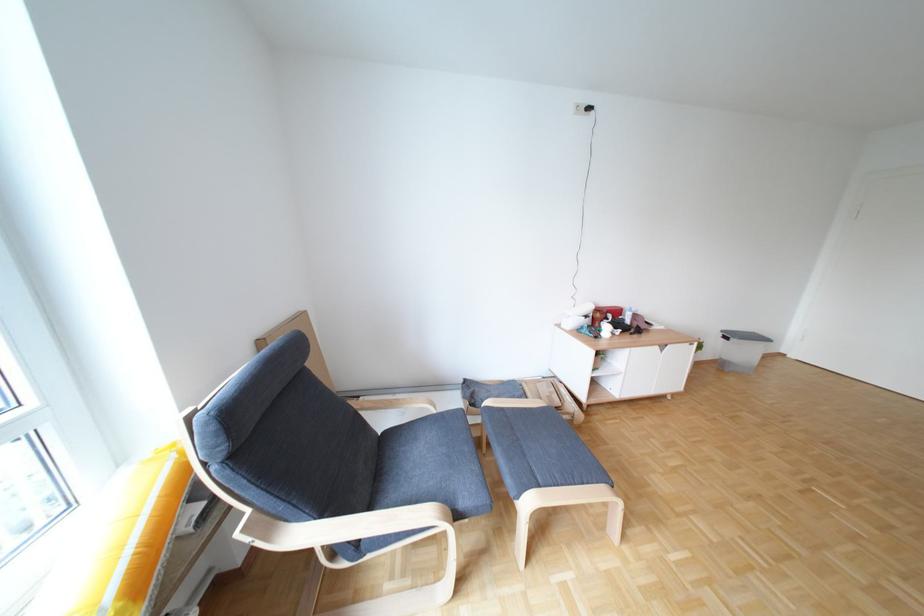
Image resolution: width=924 pixels, height=616 pixels. Describe the element at coordinates (341, 527) in the screenshot. I see `the chair armrest` at that location.